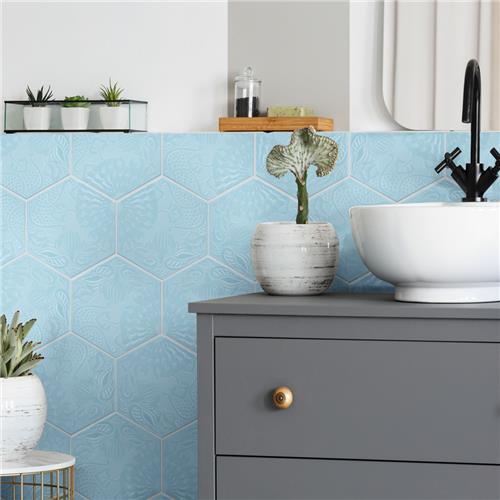
The height and width of the screenshot is (500, 500). I want to click on hot water handle, so click(x=444, y=163).